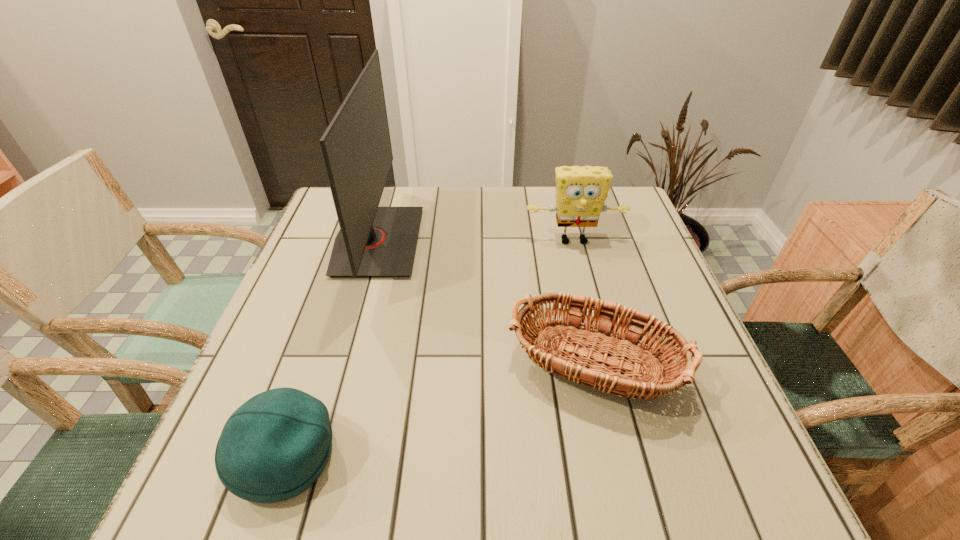
Where is `free spot between the basket and the beanie`? This screenshot has width=960, height=540. free spot between the basket and the beanie is located at coordinates (444, 416).

Locate an element on the screen. free space between the beanie and the tallest object is located at coordinates (332, 349).

At what (x,y) coordinates should I click in order to perform the action: click on vacant space that is in between the sponge and the monitor. Please return your answer as a coordinate pair (x, y). This screenshot has height=540, width=960. Looking at the image, I should click on (475, 241).

What are the coordinates of `vacant space in between the beanie and the basket` in the screenshot? It's located at (444, 416).

Where is `the closest object to the basket`? The width and height of the screenshot is (960, 540). the closest object to the basket is located at coordinates (373, 241).

Locate an element on the screen. The width and height of the screenshot is (960, 540). the second closest object to the monitor is located at coordinates (274, 446).

In order to click on vacant area that satisfies the following two spatial constraints: 1. on the screen side of the basket; 2. on the left side of the tallest object in this screenshot , I will do `click(339, 377)`.

The height and width of the screenshot is (540, 960). Find the location of `vacant position in the image that satisfies the following two spatial constraints: 1. on the face of the third shortest object; 2. on the screen side of the monitor`. vacant position in the image that satisfies the following two spatial constraints: 1. on the face of the third shortest object; 2. on the screen side of the monitor is located at coordinates (574, 241).

Find the location of a particular element. The height and width of the screenshot is (540, 960). vacant space that satisfies the following two spatial constraints: 1. on the back side of the basket; 2. on the right side of the beanie is located at coordinates (313, 377).

Where is `free space in the image that satisfies the following two spatial constraints: 1. on the screen side of the basket; 2. on the left side of the tallest object`? The image size is (960, 540). free space in the image that satisfies the following two spatial constraints: 1. on the screen side of the basket; 2. on the left side of the tallest object is located at coordinates (339, 377).